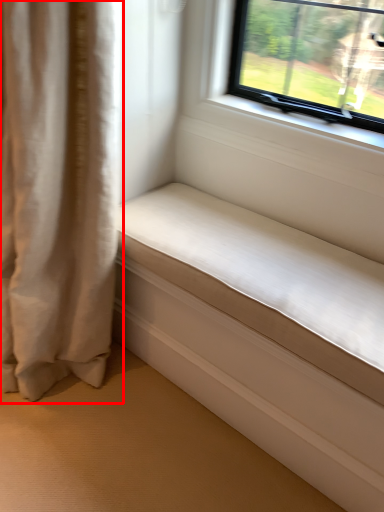
Question: From the image's perspective, what is the correct spatial relationship of curtain (annotated by the red box) in relation to studio couch?

Choices:
 (A) below
 (B) above

Answer: (B)